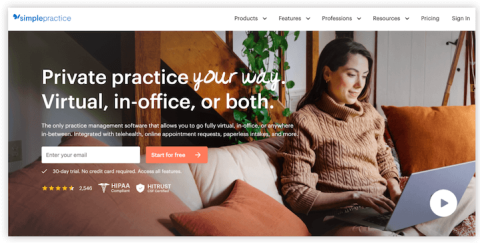
You are a GUI agent. You are given a task and a screenshot of the screen. Output one action in this format:
    pyautogui.click(x=<x>, y=<y>)
    Task: Click on the wooden stairs behind the couch leading to a second floor interior of a home
    This screenshot has height=243, width=480.
    Given the screenshot: What is the action you would take?
    pyautogui.click(x=185, y=52)